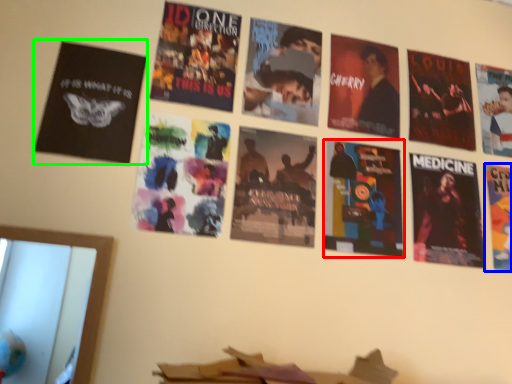
Question: Which object is the farthest from poster (highlighted by a red box)? Choose among these: poster (highlighted by a blue box) or poster (highlighted by a green box).

Choices:
 (A) poster
 (B) poster

Answer: (B)